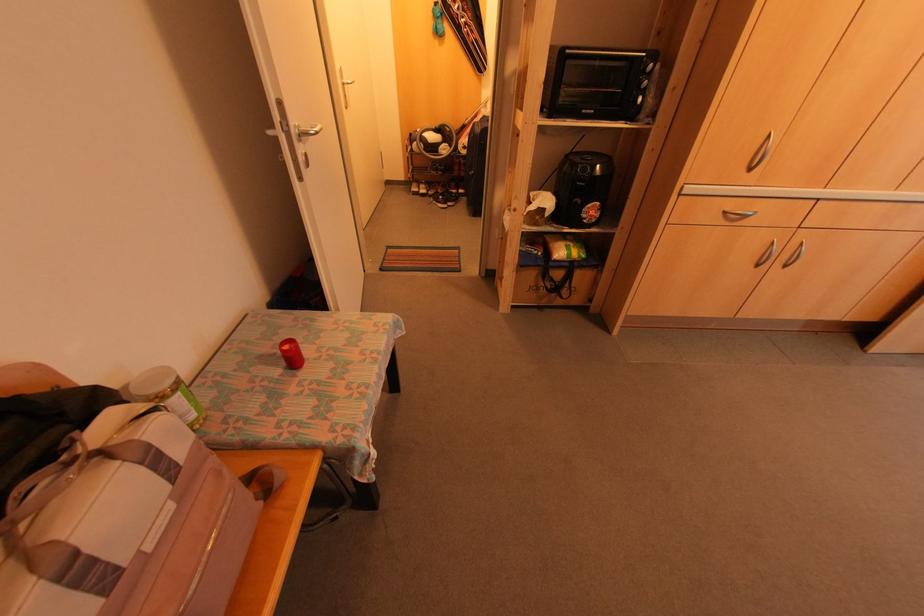
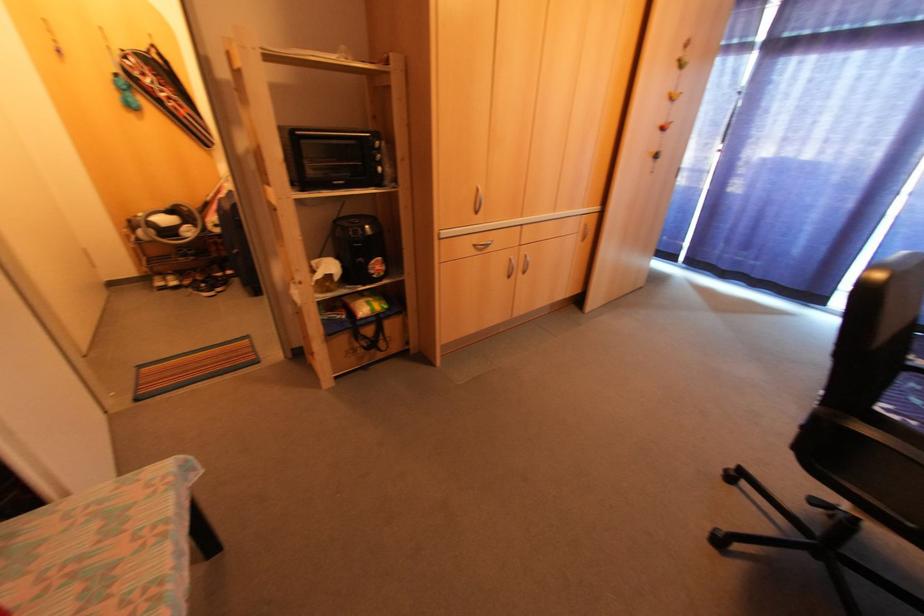
Locate, in the second image, the point that corresponds to point (723, 213) in the first image.

(472, 246)